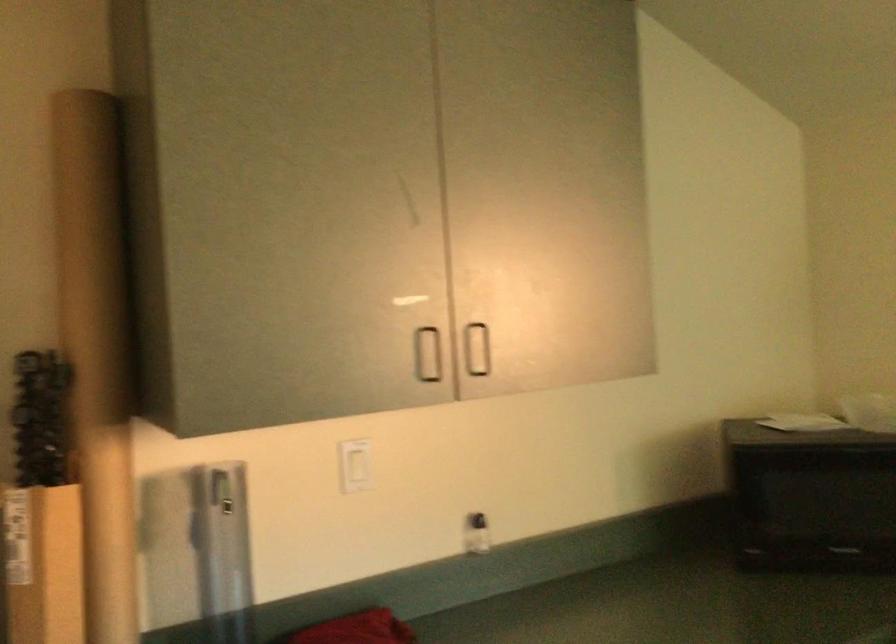
Question: How did the camera likely rotate?

Choices:
 (A) Left
 (B) Right
 (C) Up
 (D) Down

Answer: (B)